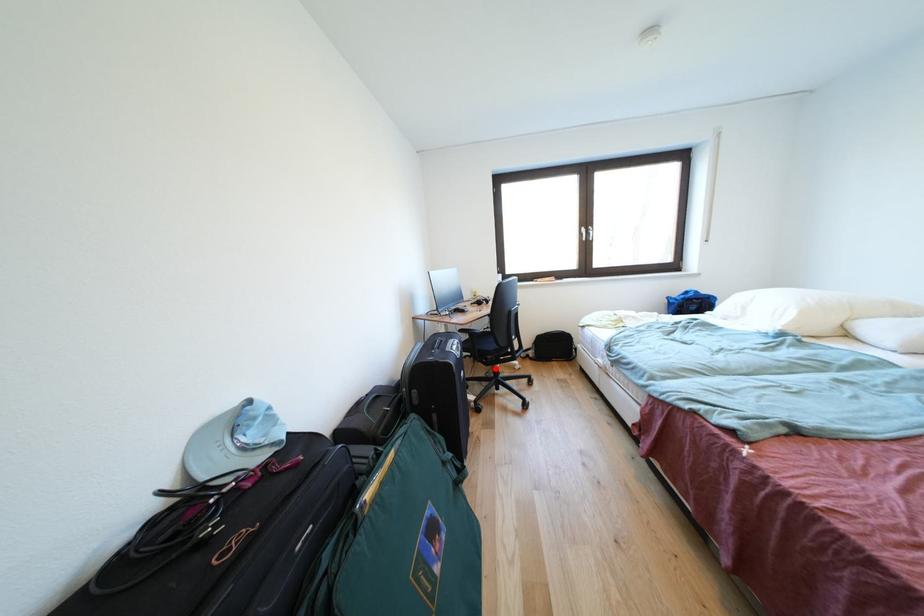
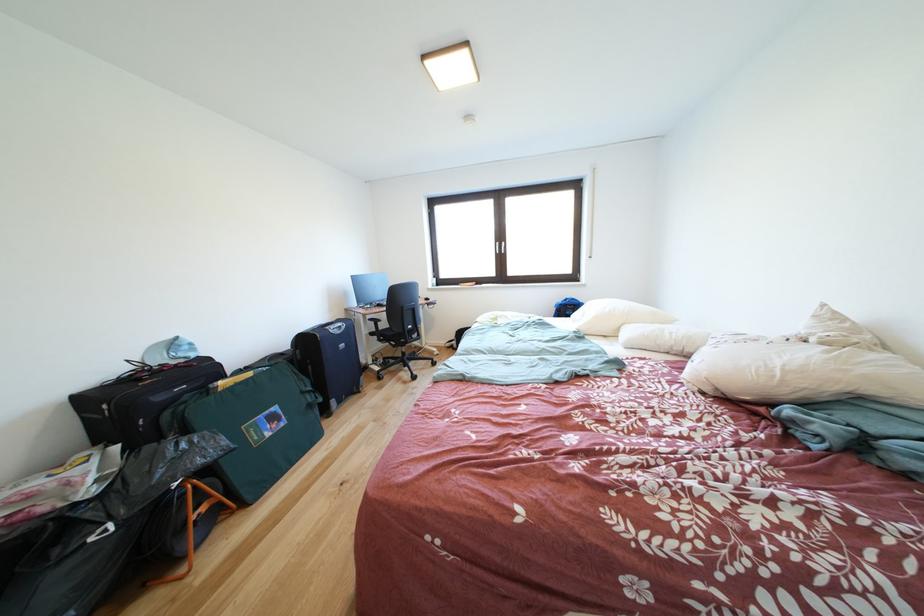
Question: I am providing you with two images of the same scene from different viewpoints. A red point is shown in image1. For the corresponding object point in image2, is it positioned nearer or farther from the camera?

Choices:
 (A) Nearer
 (B) Farther

Answer: (B)